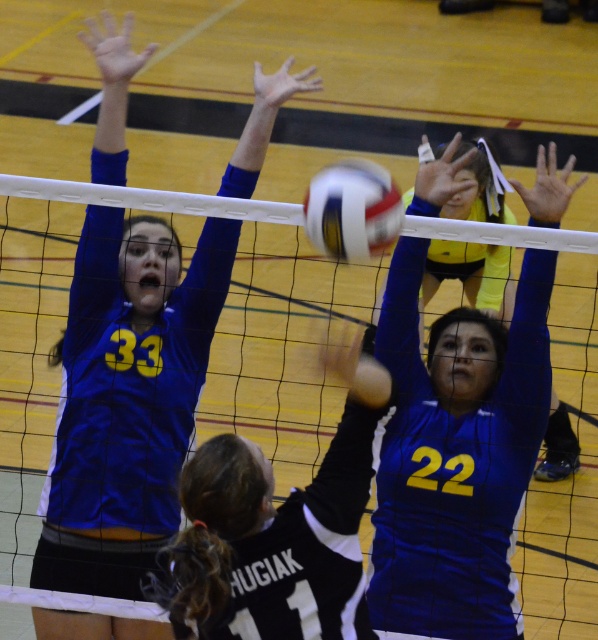
Consider the image. Does black jersey at center appear on the left side of white matte volleyball at center?

Indeed, black jersey at center is positioned on the left side of white matte volleyball at center.

Does black jersey at center appear under white matte volleyball at center?

Indeed, black jersey at center is positioned under white matte volleyball at center.

The height and width of the screenshot is (640, 598). Describe the element at coordinates (277, 531) in the screenshot. I see `black jersey at center` at that location.

This screenshot has width=598, height=640. Find the location of `black jersey at center`. black jersey at center is located at coordinates (277, 531).

Between blue jersey at center and white matte volleyball at center, which one appears on the right side from the viewer's perspective?

blue jersey at center

Can you confirm if blue jersey at center is thinner than white matte volleyball at center?

In fact, blue jersey at center might be wider than white matte volleyball at center.

This screenshot has height=640, width=598. In order to click on blue jersey at center in this screenshot , I will do `click(456, 454)`.

Is point (349, 266) more distant than point (261, 96)?

Yes.

Does white mesh net at center appear on the right side of matte blue jersey at upper left?

In fact, white mesh net at center is to the left of matte blue jersey at upper left.

Identify the location of white mesh net at center. The width and height of the screenshot is (598, 640). (212, 346).